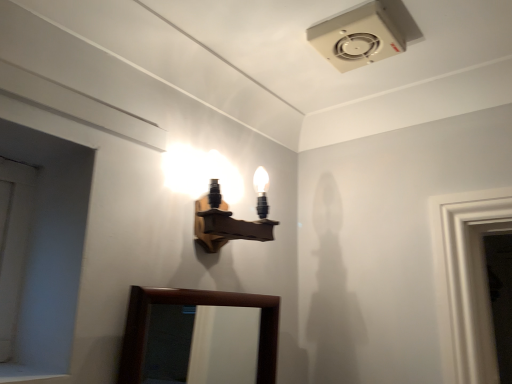
What do you see at coordinates (231, 218) in the screenshot? The width and height of the screenshot is (512, 384). I see `wooden wall sconce at upper center` at bounding box center [231, 218].

Measure the distance between white matte door at left and camera.

They are 32.59 inches apart.

Locate an element on the screen. This screenshot has width=512, height=384. wooden wall sconce at upper center is located at coordinates (231, 218).

Considering the relative positions of wooden wall sconce at upper center and brown wooden mirror at lower center in the image provided, is wooden wall sconce at upper center behind brown wooden mirror at lower center?

Yes, the depth of wooden wall sconce at upper center is greater than that of brown wooden mirror at lower center.

Is wooden wall sconce at upper center positioned with its back to brown wooden mirror at lower center?

No, wooden wall sconce at upper center's orientation is not away from brown wooden mirror at lower center.

What are the coordinates of `lamp above the brown wooden mirror at lower center (from the image's perspective)` in the screenshot? It's located at (231, 218).

From the picture: Between wooden wall sconce at upper center and brown wooden mirror at lower center, which one has larger width?

wooden wall sconce at upper center is wider.

From a real-world perspective, is brown wooden mirror at lower center above or below wooden wall sconce at upper center?

Clearly, from a real-world perspective, brown wooden mirror at lower center is below wooden wall sconce at upper center.

Looking at this image, which is in front, brown wooden mirror at lower center or wooden wall sconce at upper center?

brown wooden mirror at lower center.

Which of these two, brown wooden mirror at lower center or wooden wall sconce at upper center, is wider?

wooden wall sconce at upper center.

From a real-world perspective, who is located lower, brown wooden mirror at lower center or white matte door at left?

brown wooden mirror at lower center.

Can you confirm if brown wooden mirror at lower center is smaller than white matte door at left?

No, brown wooden mirror at lower center is not smaller than white matte door at left.

Between brown wooden mirror at lower center and white matte door at left, which one has less height?

With less height is white matte door at left.

Does brown wooden mirror at lower center come behind white matte door at left?

That is True.

Which is in front, point (9, 351) or point (167, 325)?

Point (9, 351)

Can you confirm if white matte door at left is taller than brown wooden mirror at lower center?

No, white matte door at left is not taller than brown wooden mirror at lower center.

Is white matte door at left beside brown wooden mirror at lower center?

No, white matte door at left is not touching brown wooden mirror at lower center.

Which object is further away from the camera, white matte door at left or brown wooden mirror at lower center?

brown wooden mirror at lower center.

Is wooden wall sconce at upper center positioned far away from white matte door at left?

→ No, wooden wall sconce at upper center is not far from white matte door at left.

Between wooden wall sconce at upper center and white matte door at left, which one is positioned behind?

Positioned behind is wooden wall sconce at upper center.

From a real-world perspective, is wooden wall sconce at upper center positioned above or below white matte door at left?

In terms of real-world spatial position, wooden wall sconce at upper center is above white matte door at left.

Is white matte door at left not near wooden wall sconce at upper center?

No, white matte door at left is not far from wooden wall sconce at upper center.

Is white matte door at left at the right side of wooden wall sconce at upper center?

In fact, white matte door at left is to the left of wooden wall sconce at upper center.

Find the location of a particular element. The height and width of the screenshot is (384, 512). lamp located on the right of white matte door at left is located at coordinates (231, 218).

Is white matte door at left oriented away from wooden wall sconce at upper center?

No, white matte door at left is not facing away from wooden wall sconce at upper center.

What are the coordinates of `lamp above the brown wooden mirror at lower center (from a real-world perspective)` in the screenshot? It's located at [x=231, y=218].

Identify the location of lamp on the right of brown wooden mirror at lower center. (231, 218).

Based on their spatial positions, is brown wooden mirror at lower center or wooden wall sconce at upper center closer to white matte door at left?

wooden wall sconce at upper center is positioned closer to the anchor white matte door at left.

Looking at the image, which one is located further to brown wooden mirror at lower center, white matte door at left or wooden wall sconce at upper center?

The object further to brown wooden mirror at lower center is white matte door at left.

From the image, which object appears to be nearer to white matte door at left, wooden wall sconce at upper center or brown wooden mirror at lower center?

wooden wall sconce at upper center is closer to white matte door at left.

Estimate the real-world distances between objects in this image. Which object is further from wooden wall sconce at upper center, white matte door at left or brown wooden mirror at lower center?

Based on the image, brown wooden mirror at lower center appears to be further to wooden wall sconce at upper center.

Looking at the image, which one is located further to wooden wall sconce at upper center, brown wooden mirror at lower center or white matte door at left?

brown wooden mirror at lower center is further to wooden wall sconce at upper center.

Based on their spatial positions, is wooden wall sconce at upper center or white matte door at left closer to brown wooden mirror at lower center?

wooden wall sconce at upper center.

The height and width of the screenshot is (384, 512). Find the location of `mirror between white matte door at left and wooden wall sconce at upper center in the horizontal direction`. mirror between white matte door at left and wooden wall sconce at upper center in the horizontal direction is located at coordinates (201, 344).